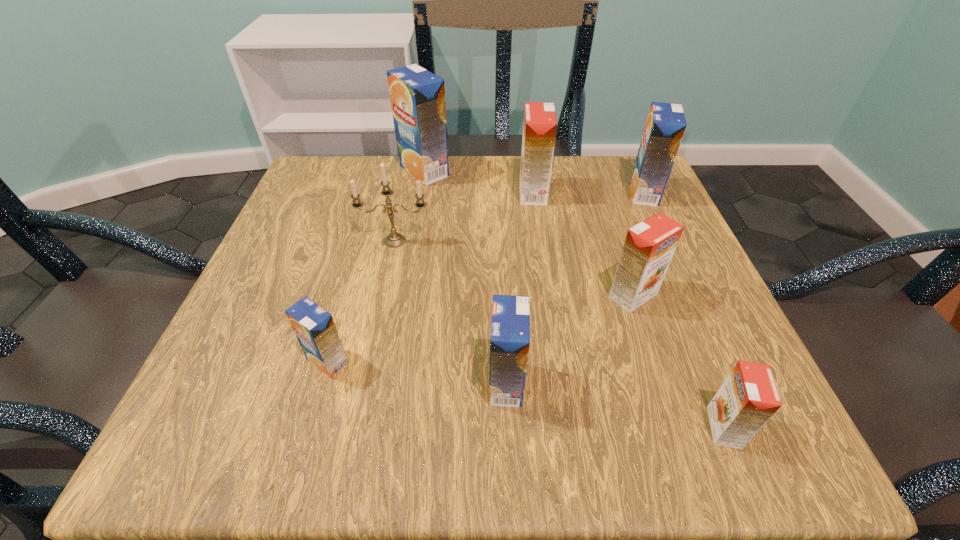
Identify the location of free space that satisfies the following two spatial constraints: 1. on the front side of the fifth farthest object; 2. on the right side of the nearest orange orange juice. Image resolution: width=960 pixels, height=540 pixels. (678, 427).

This screenshot has height=540, width=960. I want to click on free space that satisfies the following two spatial constraints: 1. on the front side of the fourth nearest orange juice; 2. on the right side of the metallic candle, so click(384, 295).